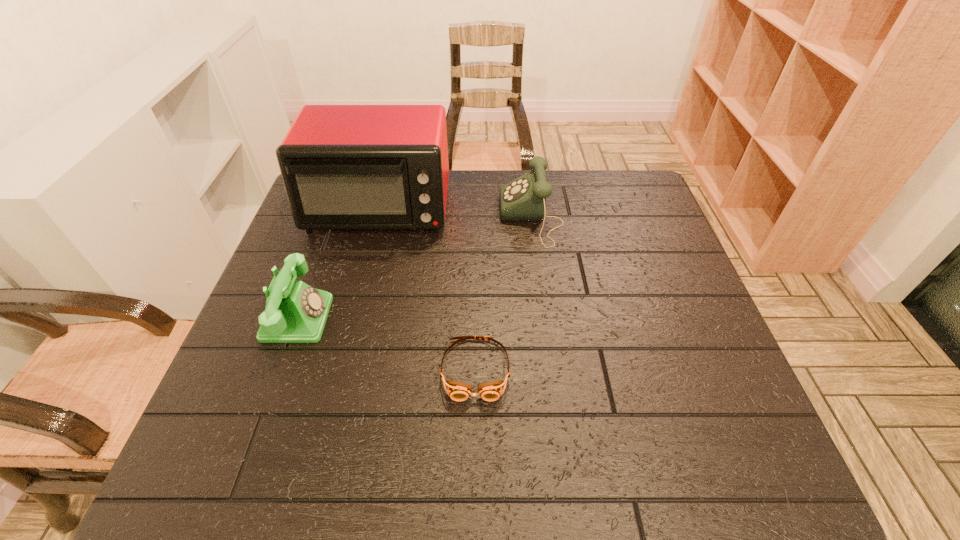
I want to click on free area in between the farther telephone and the toaster oven, so click(x=455, y=213).

Identify the location of blank region between the left telephone and the tallest object. (338, 263).

Find the location of `vacant area that lies between the farther telephone and the shortest object`. vacant area that lies between the farther telephone and the shortest object is located at coordinates (503, 293).

The width and height of the screenshot is (960, 540). Find the location of `vacant space in between the farther telephone and the toaster oven`. vacant space in between the farther telephone and the toaster oven is located at coordinates (455, 213).

The height and width of the screenshot is (540, 960). What are the coordinates of `vacant space that is in between the shortest object and the left telephone` in the screenshot? It's located at (387, 343).

The width and height of the screenshot is (960, 540). In order to click on empty space that is in between the nearer telephone and the toaster oven in this screenshot , I will do `click(338, 263)`.

Where is `vacant space that is in between the goggles and the nearer telephone`? vacant space that is in between the goggles and the nearer telephone is located at coordinates (387, 343).

You are a GUI agent. You are given a task and a screenshot of the screen. Output one action in this format:
    pyautogui.click(x=<x>, y=<y>)
    Task: Click on the vacant area that lies between the tallest object and the right telephone
    The image size is (960, 540).
    Given the screenshot: What is the action you would take?
    pyautogui.click(x=455, y=213)

This screenshot has width=960, height=540. I want to click on unoccupied area between the nearer telephone and the right telephone, so click(415, 268).

The height and width of the screenshot is (540, 960). I want to click on empty location between the farther telephone and the left telephone, so click(x=415, y=268).